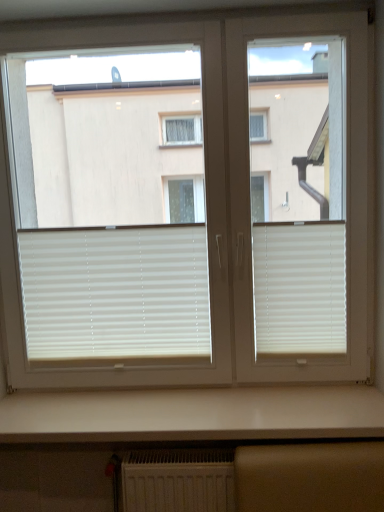
Question: Which is correct: white glossy counter top at lower center is inside white matte blinds at center, marked as the 2th window blind in a right-to-left arrangement, or outside of it?

Choices:
 (A) inside
 (B) outside

Answer: (B)

Question: Considering the positions of white glossy counter top at lower center and white matte blinds at center, placed as the first window blind when sorted from left to right, in the image, is white glossy counter top at lower center bigger or smaller than white matte blinds at center, placed as the first window blind when sorted from left to right,?

Choices:
 (A) big
 (B) small

Answer: (A)

Question: Considering the real-world distances, which object is closest to the white matte blinds at right, arranged as the 2th window blind when viewed from the left?

Choices:
 (A) white matte blinds at center
 (B) white glossy counter top at lower center
 (C) white textured radiator at lower center
 (D) white matte blinds at center
 (E) white matte blinds at center, placed as the first window blind when sorted from left to right

Answer: (B)

Question: Estimate the real-world distances between objects in this image. Which object is farther from the white matte blinds at center, marked as the 2th window blind in a right-to-left arrangement?

Choices:
 (A) white glossy counter top at lower center
 (B) white textured radiator at lower center
 (C) white matte blinds at center
 (D) white matte blinds at center
 (E) white matte blinds at right, positioned as the first window blind in right-to-left order

Answer: (D)